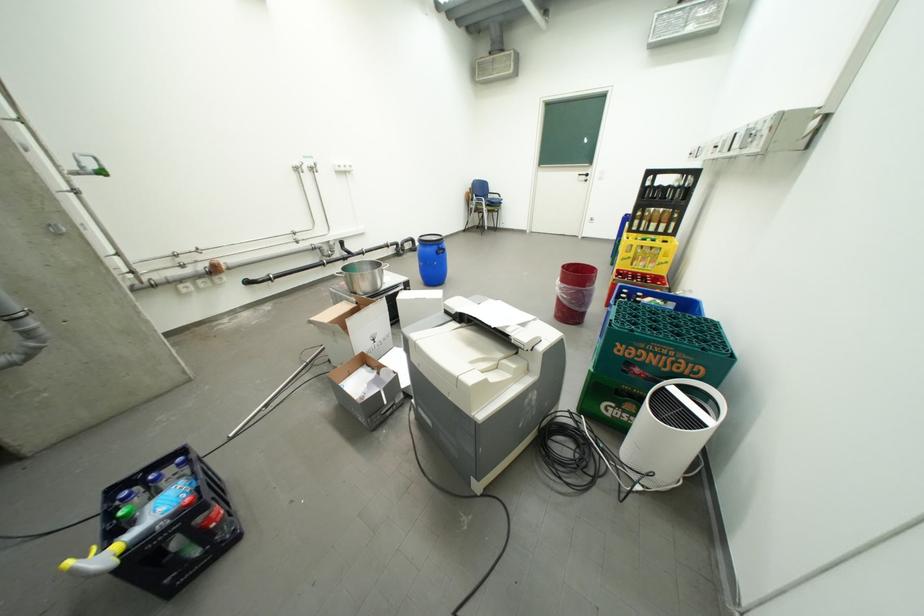
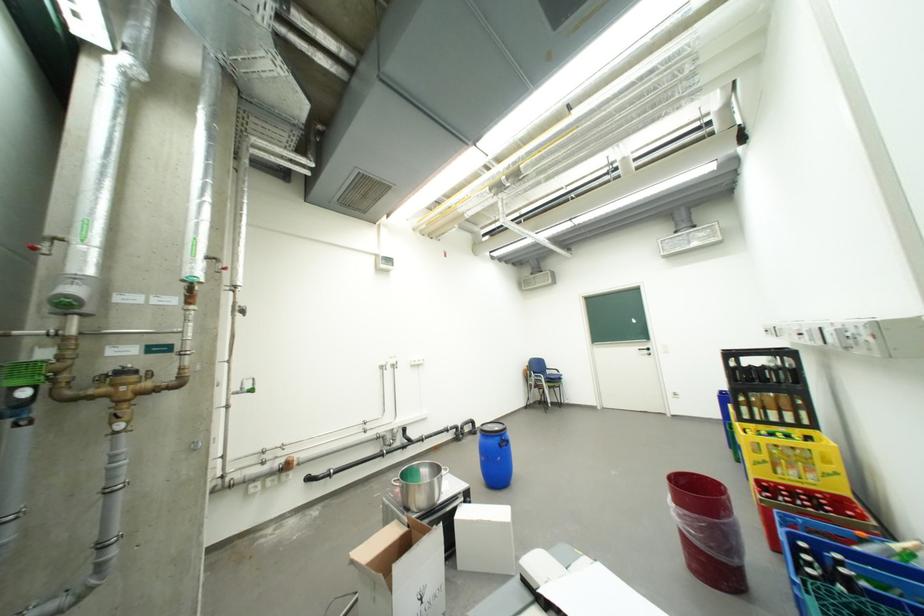
Find the pixel in the second image that matches pixel 347 328 in the first image.

(392, 577)